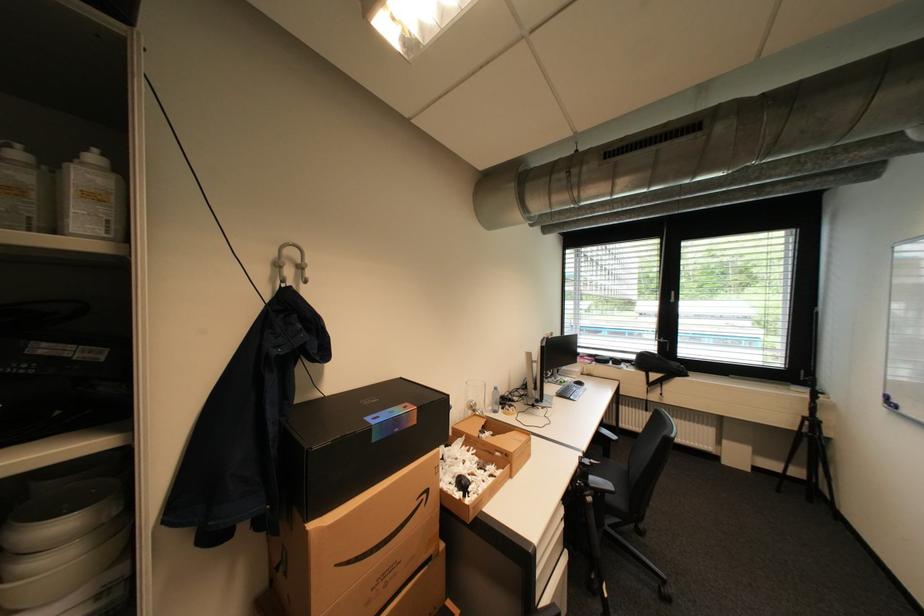
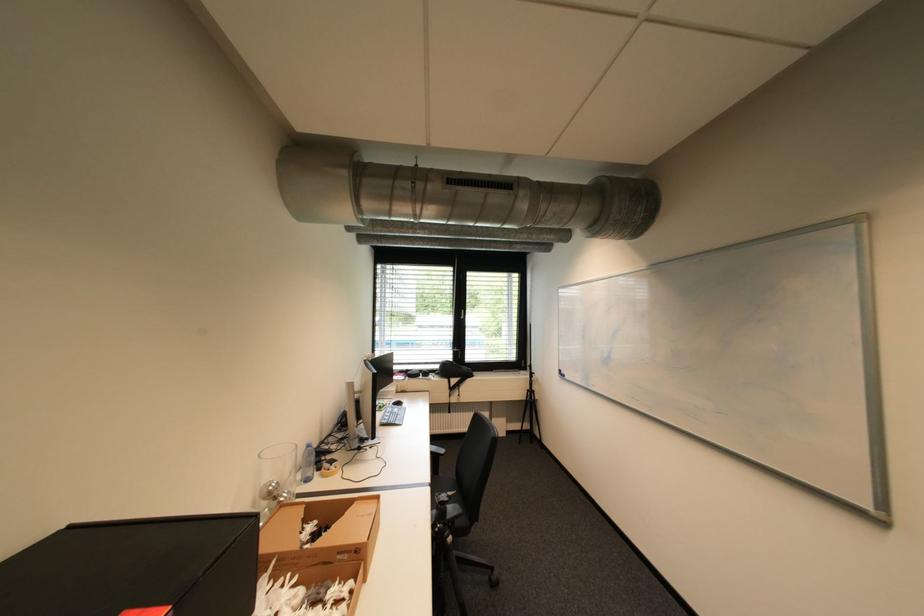
Find the pixel in the second image that matches (x=598, y=499) in the first image.

(458, 540)